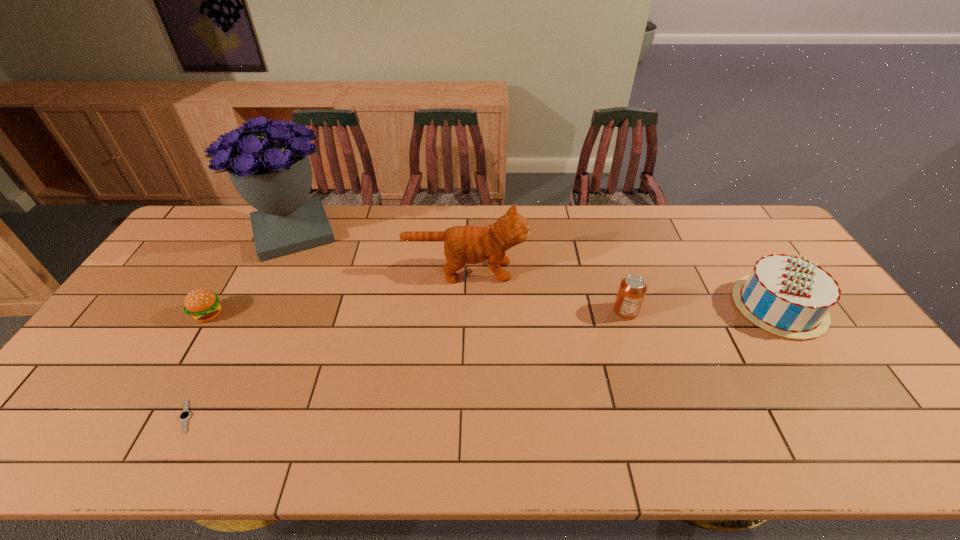
Locate an element on the screen. This screenshot has height=540, width=960. vacant space at the left edge is located at coordinates [x=135, y=335].

Locate an element on the screen. This screenshot has width=960, height=540. vacant space at the far left corner of the desktop is located at coordinates (178, 243).

Locate an element on the screen. Image resolution: width=960 pixels, height=540 pixels. vacant area at the far right corner of the desktop is located at coordinates (750, 210).

At what (x,y) coordinates should I click in order to perform the action: click on free space between the third shortest object and the second shortest object. Please return your answer as a coordinate pair (x, y). This screenshot has height=540, width=960. Looking at the image, I should click on (417, 313).

This screenshot has width=960, height=540. I want to click on free space between the tallest object and the fifth shortest object, so click(379, 251).

Where is `free spot between the can and the fourth object from left to right`? This screenshot has width=960, height=540. free spot between the can and the fourth object from left to right is located at coordinates (545, 291).

What are the coordinates of `free space between the fifth shortest object and the fifth tallest object` in the screenshot? It's located at (x=337, y=292).

The image size is (960, 540). Identify the location of free space between the hamburger and the tallest object. (252, 273).

Identify the location of free space that is in between the fifth shortest object and the watch. This screenshot has height=540, width=960. (325, 343).

The width and height of the screenshot is (960, 540). What are the coordinates of `empty location between the nearest object and the cat` in the screenshot? It's located at (325, 343).